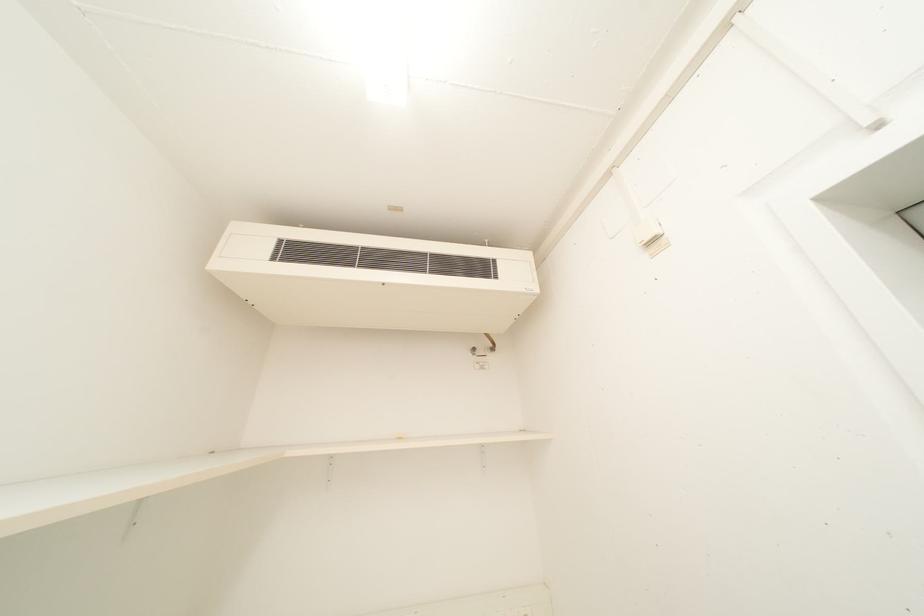
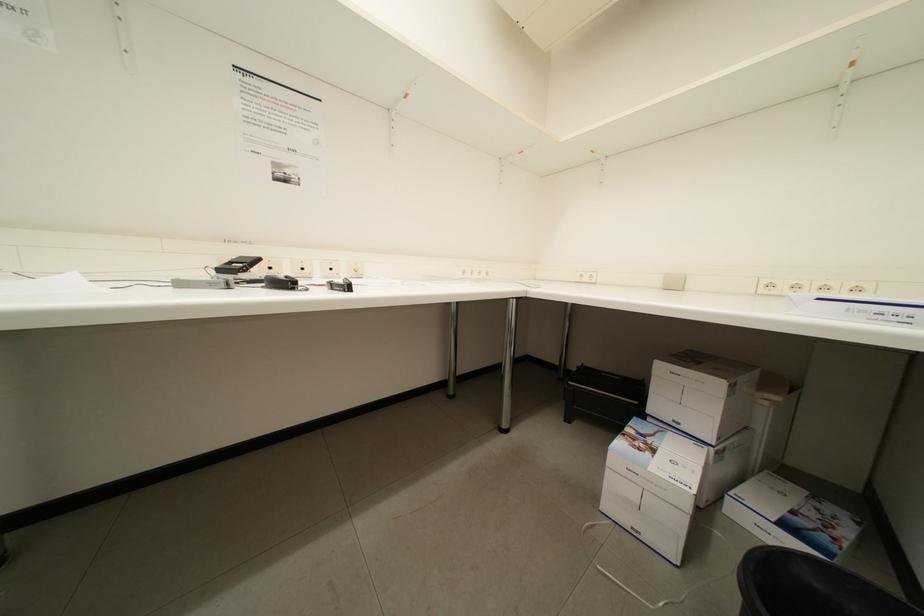
The images are taken continuously from a first-person perspective. In which direction is your viewpoint rotating?

The camera's rotation is toward left-down.